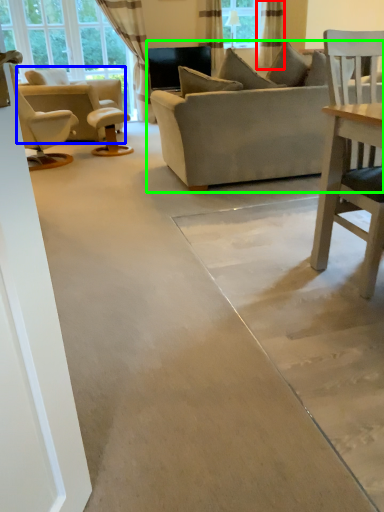
Question: Which object is the farthest from curtain (highlighted by a red box)? Choose among these: chair (highlighted by a blue box) or studio couch (highlighted by a green box).

Choices:
 (A) chair
 (B) studio couch

Answer: (B)